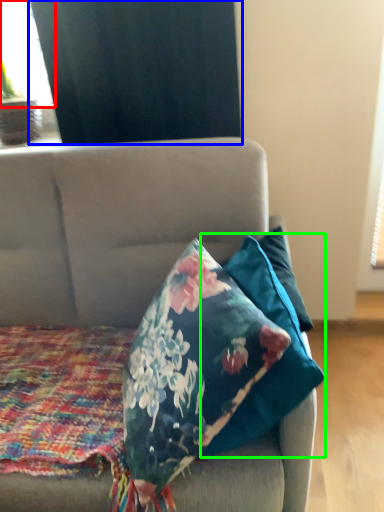
Question: Which object is the closest to the window screen (highlighted by a red box)? Choose among these: curtain (highlighted by a blue box) or pillow (highlighted by a green box).

Choices:
 (A) curtain
 (B) pillow

Answer: (A)